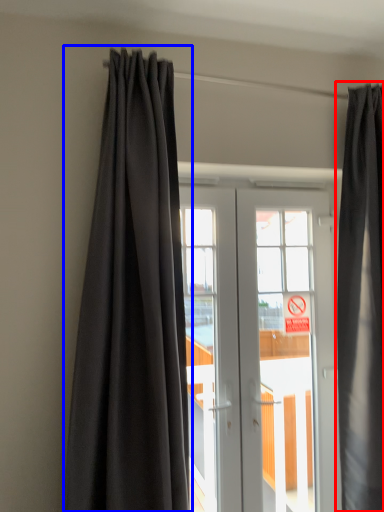
Question: Among these objects, which one is farthest to the camera, curtain (highlighted by a red box) or curtain (highlighted by a blue box)?

Choices:
 (A) curtain
 (B) curtain

Answer: (A)